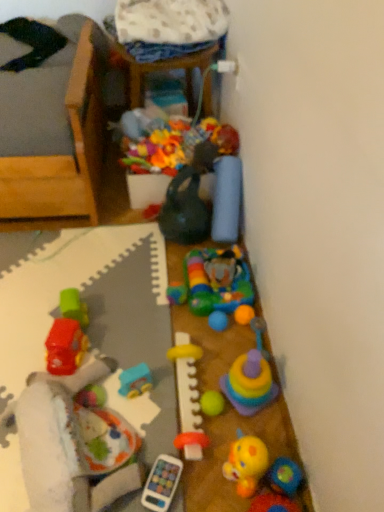
Identify the location of free space that is in between matte green kettle at center, the 3th toy from the left, and blue plastic toy car at center, positioned as the tenth toy in right-to-left order. (159, 307).